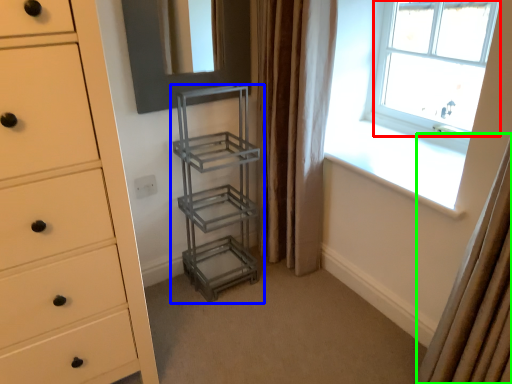
Question: Which object is the farthest from window (highlighted by a red box)? Choose among these: shelf (highlighted by a blue box) or curtain (highlighted by a green box).

Choices:
 (A) shelf
 (B) curtain

Answer: (B)